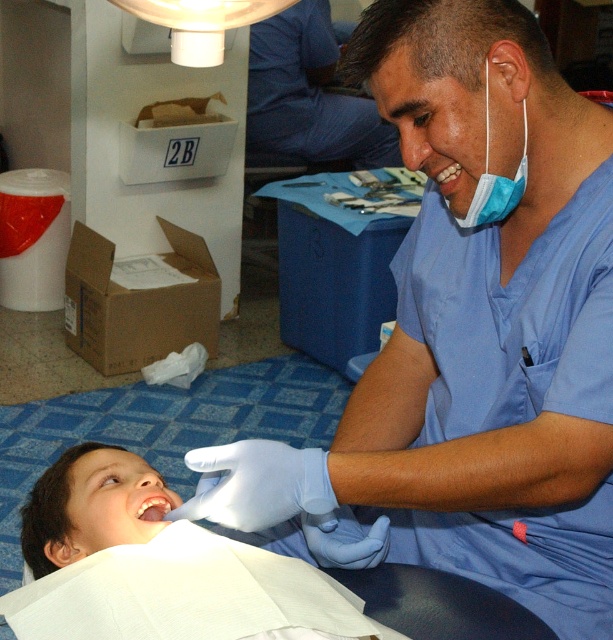
You are a dental assistant who needs to reach the white cloth napkin at lower left to clean up a spill. The camera represents your eye level. Is the napkin within arm reach from your current position?

The white cloth napkin at lower left is 32.61 inches away from the camera, which represents your eye level. Since the average arm reach is about 28 inches, the napkin is slightly out of reach and you would need to move closer to grab it.